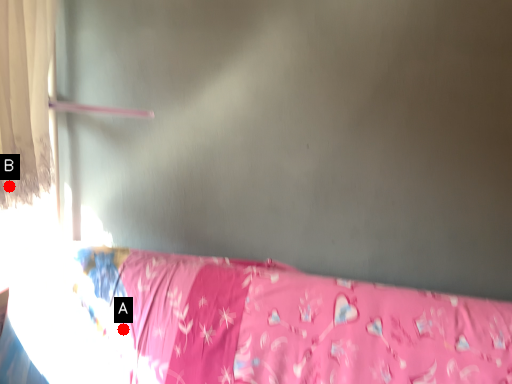
Question: Two points are circled on the image, labeled by A and B beside each circle. Which of the following is the closest to the observer?

Choices:
 (A) A is closer
 (B) B is closer

Answer: (B)